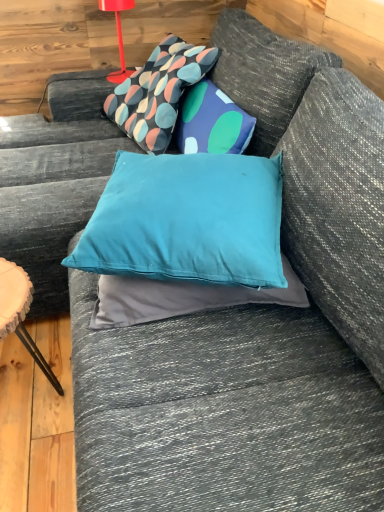
Question: Should I look upward or downward to see wooden side table at lower left?

Choices:
 (A) down
 (B) up

Answer: (A)

Question: Is wooden side table at lower left far from patterned fabric pillow at upper center, which ranks as the second pillow in front-to-back order?

Choices:
 (A) yes
 (B) no

Answer: (B)

Question: Considering the relative sizes of wooden side table at lower left and patterned fabric pillow at upper center, the first pillow positioned from the back, in the image provided, is wooden side table at lower left wider than patterned fabric pillow at upper center, the first pillow positioned from the back,?

Choices:
 (A) yes
 (B) no

Answer: (B)

Question: Is wooden side table at lower left looking in the opposite direction of patterned fabric pillow at upper center, which appears as the first pillow when viewed from the top?

Choices:
 (A) no
 (B) yes

Answer: (A)

Question: Does wooden side table at lower left appear on the left side of patterned fabric pillow at upper center, which ranks as the second pillow in front-to-back order?

Choices:
 (A) no
 (B) yes

Answer: (B)

Question: From a real-world perspective, is wooden side table at lower left positioned over patterned fabric pillow at upper center, which appears as the first pillow when viewed from the top, based on gravity?

Choices:
 (A) yes
 (B) no

Answer: (B)

Question: Is wooden side table at lower left at the right side of patterned fabric pillow at upper center, the 2th pillow ordered from the bottom?

Choices:
 (A) yes
 (B) no

Answer: (B)

Question: Is the depth of matte red table lamp at upper left less than that of wooden side table at lower left?

Choices:
 (A) yes
 (B) no

Answer: (B)

Question: From the image's perspective, is matte red table lamp at upper left under wooden side table at lower left?

Choices:
 (A) no
 (B) yes

Answer: (A)

Question: Is matte red table lamp at upper left at the left side of wooden side table at lower left?

Choices:
 (A) yes
 (B) no

Answer: (B)

Question: Does matte red table lamp at upper left have a larger size compared to wooden side table at lower left?

Choices:
 (A) no
 (B) yes

Answer: (A)

Question: From the image's perspective, is matte red table lamp at upper left located above wooden side table at lower left?

Choices:
 (A) yes
 (B) no

Answer: (A)

Question: Is matte red table lamp at upper left aimed at wooden side table at lower left?

Choices:
 (A) yes
 (B) no

Answer: (B)

Question: Does patterned fabric pillow at upper center, which ranks as the second pillow in front-to-back order, have a larger size compared to matte red table lamp at upper left?

Choices:
 (A) no
 (B) yes

Answer: (B)